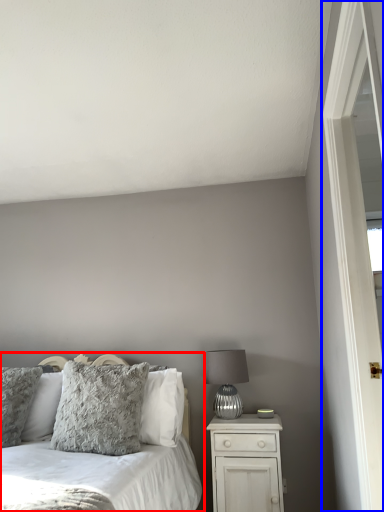
Question: Which of the following is the farthest to the observer, bed (highlighted by a red box) or screen door (highlighted by a blue box)?

Choices:
 (A) bed
 (B) screen door

Answer: (B)